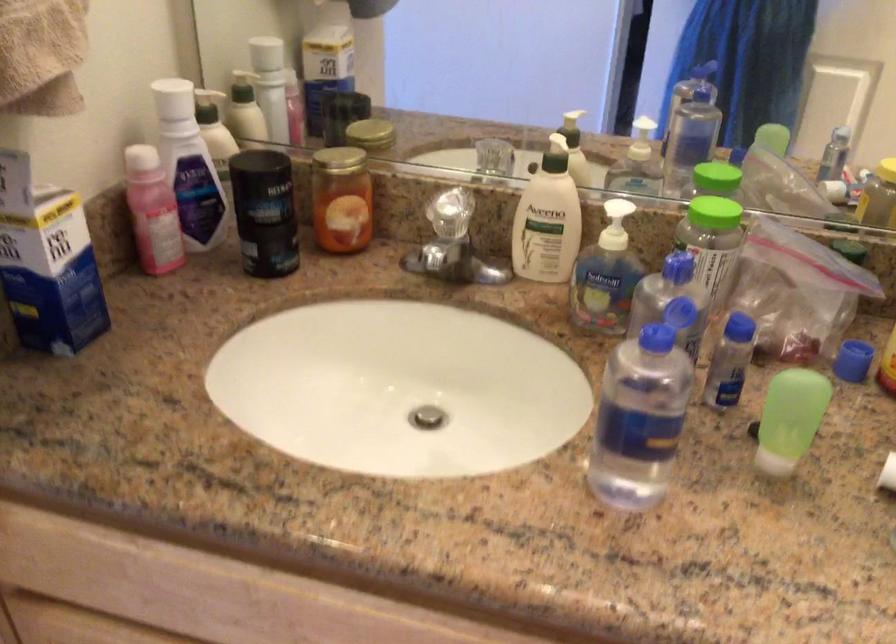
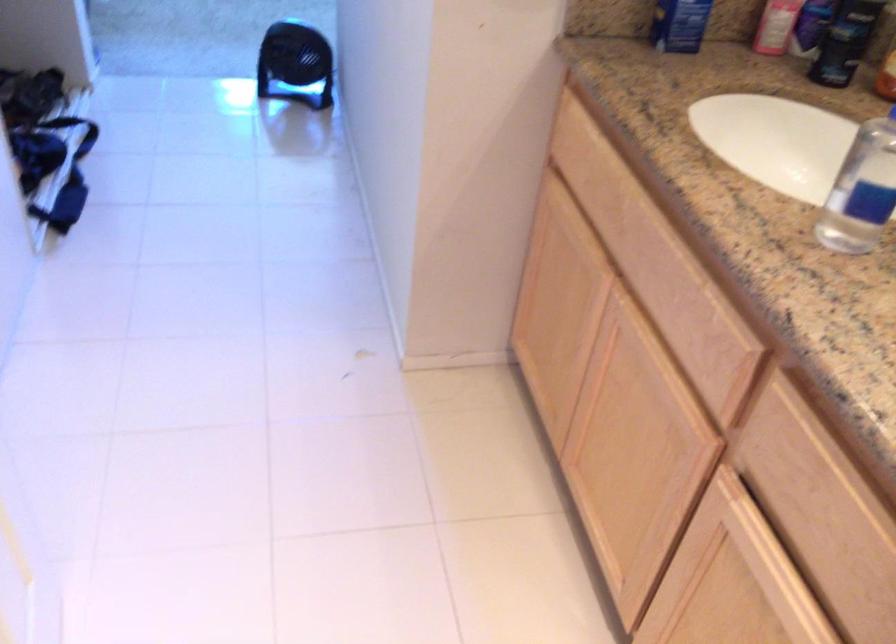
The point at (286, 219) is marked in the first image. Where is the corresponding point in the second image?

(845, 41)